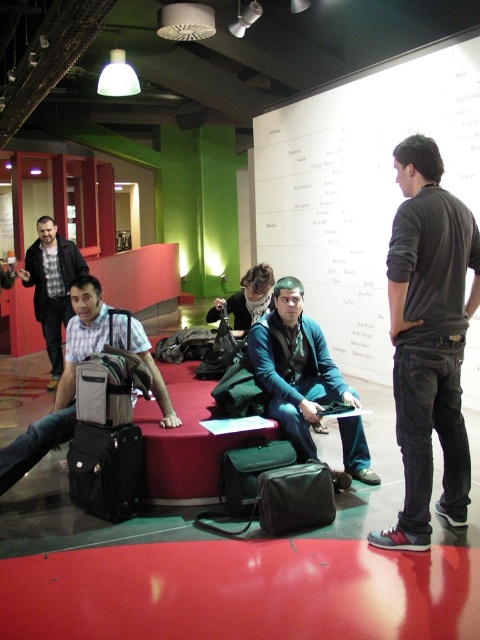
The height and width of the screenshot is (640, 480). Find the location of `dark gray jeans at center`. dark gray jeans at center is located at coordinates (429, 339).

Is dark gray jeans at center bigger than matte gray backpack at left?

No.

The height and width of the screenshot is (640, 480). What do you see at coordinates (429, 339) in the screenshot? I see `dark gray jeans at center` at bounding box center [429, 339].

This screenshot has height=640, width=480. I want to click on dark gray jeans at center, so click(x=429, y=339).

Between point (48, 422) and point (267, 467), which one is positioned in front?

Positioned in front is point (267, 467).

Is matte gray backpack at left further to camera compared to dark green fabric bag at center?

Yes, matte gray backpack at left is behind dark green fabric bag at center.

Where is `matte gray backpack at left`? The image size is (480, 640). matte gray backpack at left is located at coordinates (60, 384).

Who is taller, matte black suitcase at left or matte black bag at center?

Standing taller between the two is matte black suitcase at left.

Where is `matte black suitcase at left`? matte black suitcase at left is located at coordinates (108, 432).

Locate an element on the screen. This screenshot has width=480, height=640. matte black suitcase at left is located at coordinates (108, 432).